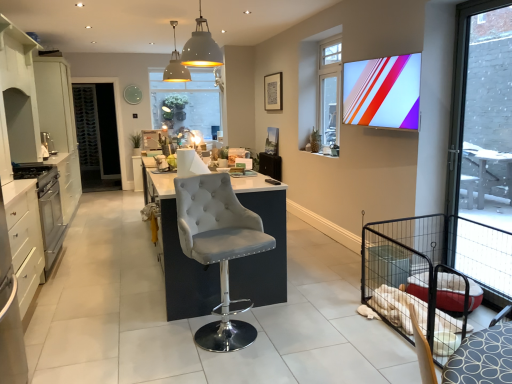
This screenshot has width=512, height=384. What are the coordinates of `free area below velvet grey bar stool at center (from a real-world perspective)` in the screenshot? It's located at click(x=227, y=333).